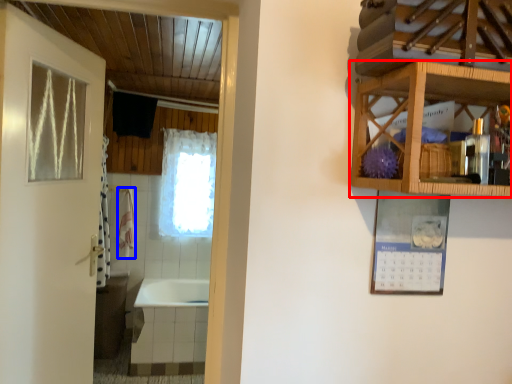
Question: Which object is closer to the camera taking this photo, cabinetry (highlighted by a red box) or towel/napkin (highlighted by a blue box)?

Choices:
 (A) cabinetry
 (B) towel/napkin

Answer: (A)